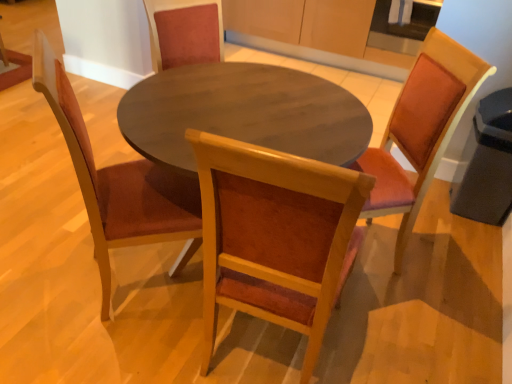
Question: Would you say wooden chair at center, marked as the second chair in a right-to-left arrangement, contains wooden chair at right, marked as the first chair in a right-to-left arrangement?

Choices:
 (A) yes
 (B) no

Answer: (B)

Question: Considering the relative sizes of wooden chair at center, the 2th chair from the left, and wooden chair at right, marked as the first chair in a right-to-left arrangement, in the image provided, is wooden chair at center, the 2th chair from the left, bigger than wooden chair at right, marked as the first chair in a right-to-left arrangement,?

Choices:
 (A) yes
 (B) no

Answer: (A)

Question: Does wooden chair at center, the 2th chair from the left, come in front of wooden chair at right, the third chair viewed from the left?

Choices:
 (A) yes
 (B) no

Answer: (A)

Question: Is the depth of wooden chair at center, the 2th chair from the left, greater than that of wooden chair at right, the third chair viewed from the left?

Choices:
 (A) yes
 (B) no

Answer: (B)

Question: From a real-world perspective, is wooden chair at center, marked as the second chair in a right-to-left arrangement, beneath wooden chair at right, marked as the first chair in a right-to-left arrangement?

Choices:
 (A) no
 (B) yes

Answer: (A)

Question: Is wooden chair at center, the 2th chair from the left, wider than wooden chair at right, the third chair viewed from the left?

Choices:
 (A) no
 (B) yes

Answer: (A)

Question: Is wooden chair at right, marked as the first chair in a right-to-left arrangement, at the left side of wooden chair at left, arranged as the third chair when viewed from the right?

Choices:
 (A) yes
 (B) no

Answer: (B)

Question: Would you consider wooden chair at right, the third chair viewed from the left, to be distant from wooden chair at left, arranged as the third chair when viewed from the right?

Choices:
 (A) no
 (B) yes

Answer: (A)

Question: Is wooden chair at right, the third chair viewed from the left, located outside wooden chair at left, arranged as the third chair when viewed from the right?

Choices:
 (A) yes
 (B) no

Answer: (A)

Question: From the image's perspective, is wooden chair at right, the third chair viewed from the left, located beneath wooden chair at left, arranged as the third chair when viewed from the right?

Choices:
 (A) no
 (B) yes

Answer: (A)

Question: Is wooden chair at left, which is the 1th chair in left-to-right order, completely or partially inside wooden chair at right, marked as the first chair in a right-to-left arrangement?

Choices:
 (A) yes
 (B) no

Answer: (B)

Question: Does wooden chair at right, the third chair viewed from the left, come in front of wooden chair at left, which is the 1th chair in left-to-right order?

Choices:
 (A) no
 (B) yes

Answer: (A)

Question: From the image's perspective, is wooden chair at left, arranged as the third chair when viewed from the right, under wooden chair at center, marked as the second chair in a right-to-left arrangement?

Choices:
 (A) yes
 (B) no

Answer: (B)